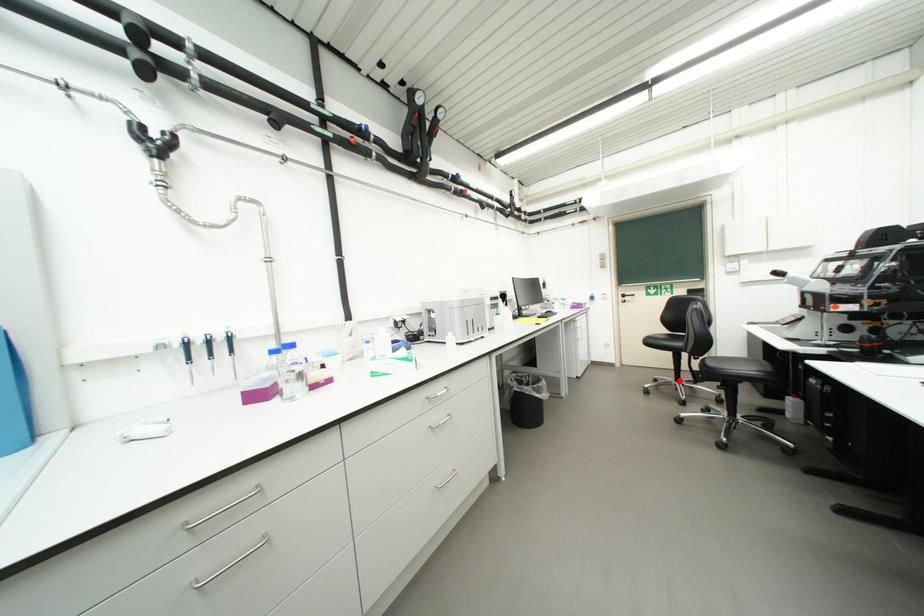
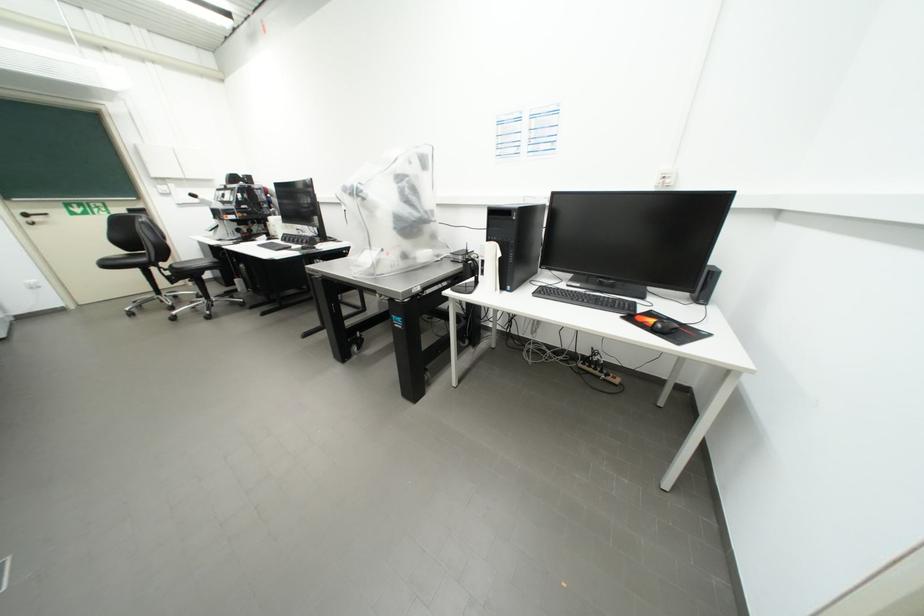
Question: A red point is marked in image1. In image2, is the corresponding 3D point closer to the camera or farther? Reply with the corresponding letter.

Choices:
 (A) The corresponding 3D point is closer.
 (B) The corresponding 3D point is farther.

Answer: (B)